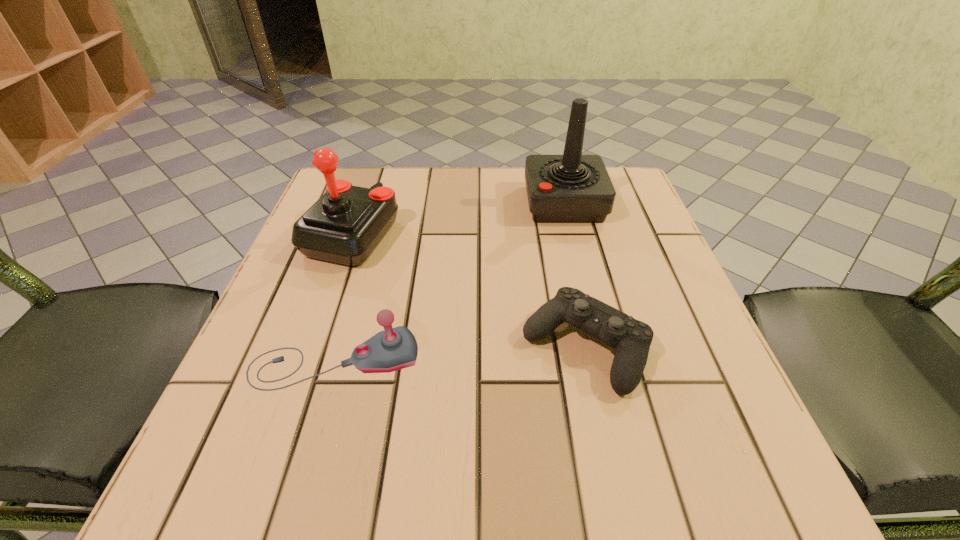
Locate an element on the screen. Image resolution: width=960 pixels, height=540 pixels. vacant space that is in between the rightmost joystick and the shortest joystick is located at coordinates (449, 282).

At what (x,y) coordinates should I click in order to perform the action: click on free area in between the third tallest object and the shortest object. Please return your answer as a coordinate pair (x, y). Image resolution: width=960 pixels, height=540 pixels. Looking at the image, I should click on (460, 354).

I want to click on free space between the control and the rightmost joystick, so click(x=575, y=275).

Find the location of a particular element. The width and height of the screenshot is (960, 540). vacant area that lies between the control and the rightmost joystick is located at coordinates (575, 275).

You are a GUI agent. You are given a task and a screenshot of the screen. Output one action in this format:
    pyautogui.click(x=<x>, y=<y>)
    Task: Click on the free space between the rightmost joystick and the nearest joystick
    
    Given the screenshot: What is the action you would take?
    pyautogui.click(x=449, y=282)

The image size is (960, 540). Identify the location of empty space that is in between the rightmost joystick and the shortest joystick. (449, 282).

At what (x,y) coordinates should I click in order to perform the action: click on vacant space that's between the control and the nearest joystick. Please return your answer as a coordinate pair (x, y). Looking at the image, I should click on (460, 354).

Point out which object is positioned as the second nearest to the nearest joystick. Please provide its 2D coordinates. Your answer should be formatted as a tuple, i.e. [(x, y)], where the tuple contains the x and y coordinates of a point satisfying the conditions above.

[(631, 339)]

This screenshot has width=960, height=540. Identify the location of object that stands as the closest to the second shortest object. (345, 225).

Identify which joystick is the nearest to the shortest object. Please provide its 2D coordinates. Your answer should be formatted as a tuple, i.e. [(x, y)], where the tuple contains the x and y coordinates of a point satisfying the conditions above.

[(393, 349)]